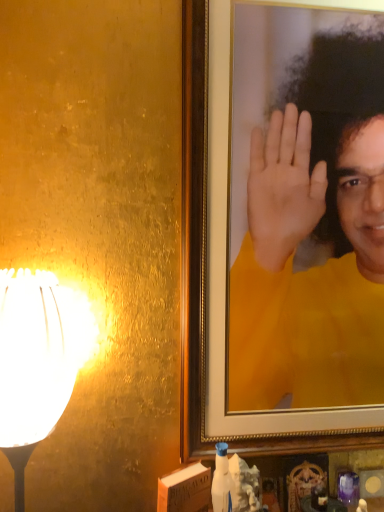
Question: Is white glossy lampshade at left to the left or to the right of yellow matte portrait at upper right in the image?

Choices:
 (A) right
 (B) left

Answer: (B)

Question: From the image's perspective, is white glossy lampshade at left positioned above or below yellow matte portrait at upper right?

Choices:
 (A) above
 (B) below

Answer: (B)

Question: From a real-world perspective, relative to yellow matte portrait at upper right, is white glossy lampshade at left vertically above or below?

Choices:
 (A) below
 (B) above

Answer: (A)

Question: From a real-world perspective, is yellow matte portrait at upper right above or below white glossy lampshade at left?

Choices:
 (A) below
 (B) above

Answer: (B)

Question: Considering the positions of yellow matte portrait at upper right and white glossy lampshade at left in the image, is yellow matte portrait at upper right taller or shorter than white glossy lampshade at left?

Choices:
 (A) short
 (B) tall

Answer: (B)

Question: From the image's perspective, is yellow matte portrait at upper right located above or below white glossy lampshade at left?

Choices:
 (A) above
 (B) below

Answer: (A)

Question: Is point (283, 194) positioned closer to the camera than point (72, 314)?

Choices:
 (A) farther
 (B) closer

Answer: (A)